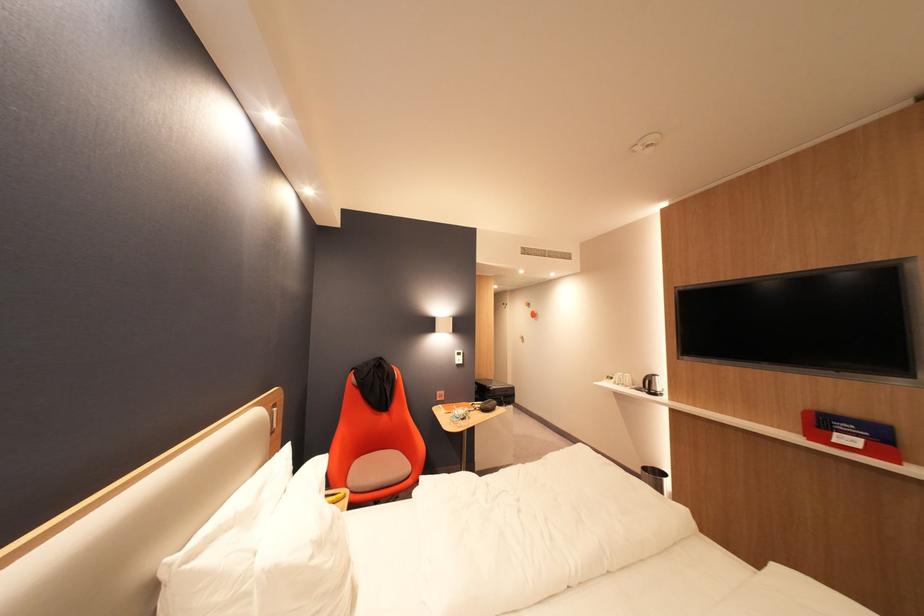
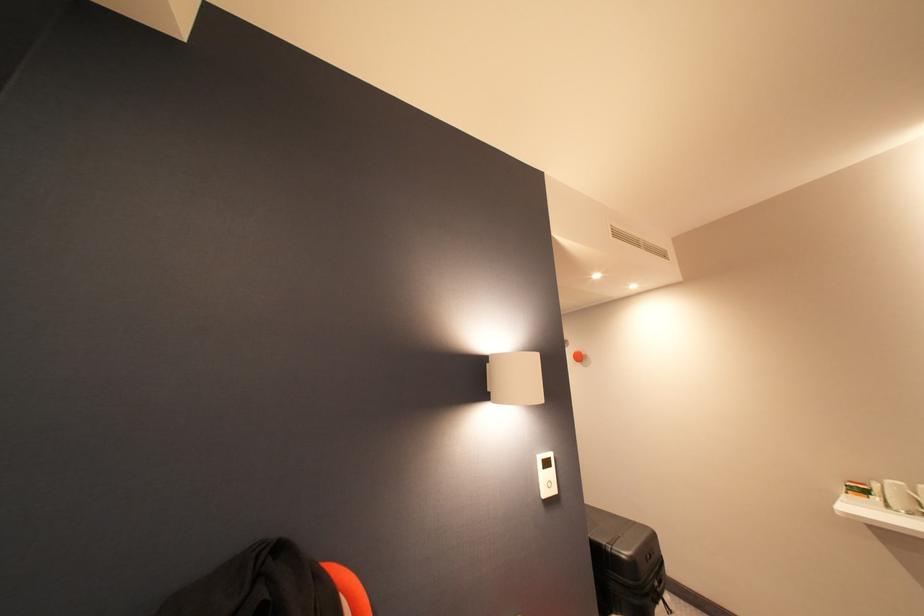
Question: What movement of the cameraman would produce the second image?

Choices:
 (A) Left
 (B) Right
 (C) Forward
 (D) Backward

Answer: (C)